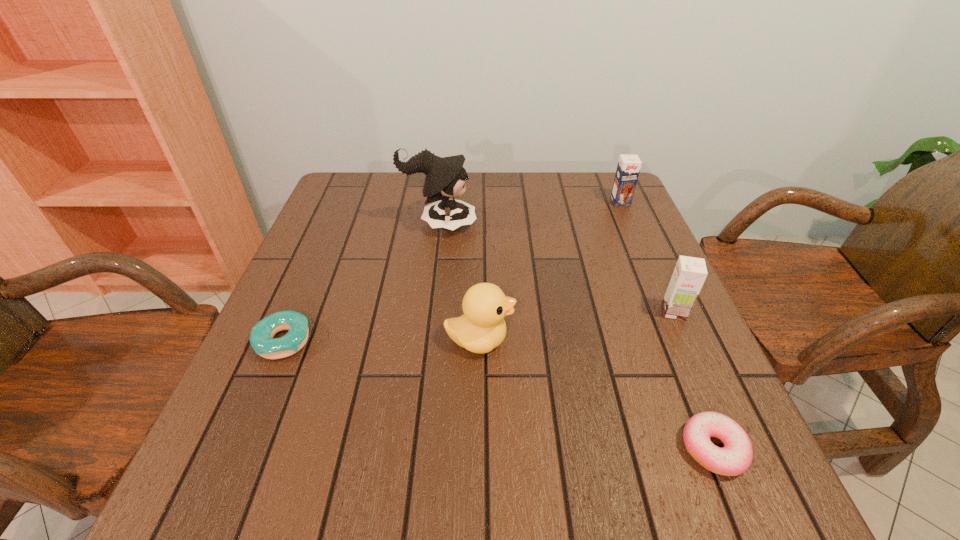
Locate an element on the screen. vacant space that satisfies the following two spatial constraints: 1. on the face of the duck; 2. on the front side of the leftmost object is located at coordinates (479, 341).

Where is `free point that satisfies the following two spatial constraints: 1. on the front label of the farthest object; 2. on the right side of the nearer chocolate milk`? Image resolution: width=960 pixels, height=540 pixels. free point that satisfies the following two spatial constraints: 1. on the front label of the farthest object; 2. on the right side of the nearer chocolate milk is located at coordinates (668, 312).

The height and width of the screenshot is (540, 960). Find the location of `vacant position in the image that satisfies the following two spatial constraints: 1. on the front label of the farther chocolate milk; 2. on the face of the duck`. vacant position in the image that satisfies the following two spatial constraints: 1. on the front label of the farther chocolate milk; 2. on the face of the duck is located at coordinates (681, 340).

You are a GUI agent. You are given a task and a screenshot of the screen. Output one action in this format:
    pyautogui.click(x=<x>, y=<y>)
    Task: Click on the free location that satisfies the following two spatial constraints: 1. on the front label of the farther chocolate milk; 2. on the face of the duck
    Image resolution: width=960 pixels, height=540 pixels.
    Given the screenshot: What is the action you would take?
    pyautogui.click(x=681, y=340)

Find the location of a particular element. This screenshot has width=960, height=540. vacant area in the image that satisfies the following two spatial constraints: 1. on the front label of the farther chocolate milk; 2. on the face of the duck is located at coordinates (681, 340).

This screenshot has height=540, width=960. Identify the location of vacant space that satisfies the following two spatial constraints: 1. on the back side of the nearer doughnut; 2. on the face of the duck. (669, 340).